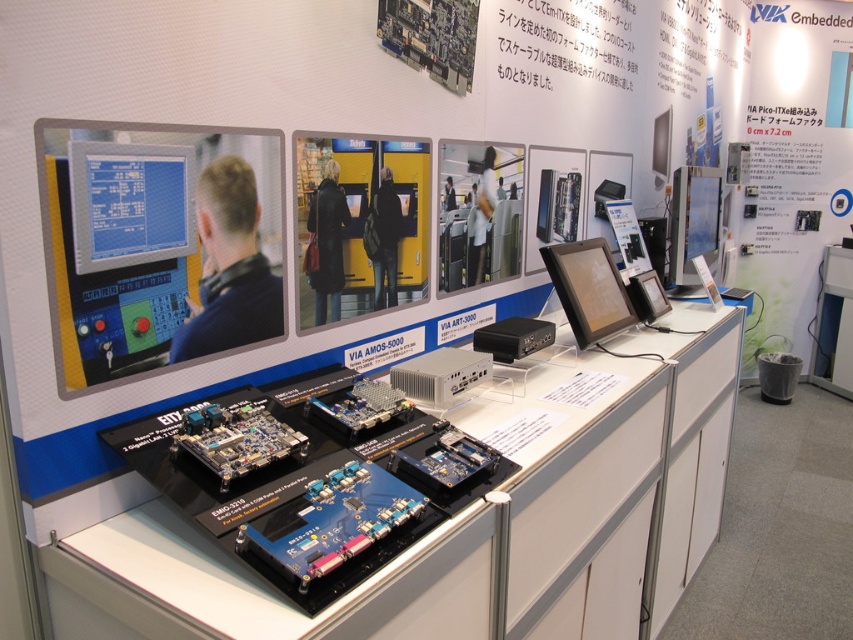
Is white paper at upper right to the left of matte black monitor at center from the viewer's perspective?

In fact, white paper at upper right is to the right of matte black monitor at center.

What do you see at coordinates (793, 163) in the screenshot? Image resolution: width=853 pixels, height=640 pixels. I see `white paper at upper right` at bounding box center [793, 163].

The height and width of the screenshot is (640, 853). Identify the location of white paper at upper right. (793, 163).

Image resolution: width=853 pixels, height=640 pixels. What are the coordinates of `white paper at upper right` in the screenshot? It's located at (793, 163).

You are a GUI agent. You are given a task and a screenshot of the screen. Output one action in this format:
    pyautogui.click(x=<x>, y=<y>)
    Task: Click on the blue glossy monitor at upper left
    
    Given the screenshot: What is the action you would take?
    pyautogui.click(x=131, y=204)

Does blue glossy monitor at upper left have a lesser width compared to blue circuit board at center?

Correct, blue glossy monitor at upper left's width is less than blue circuit board at center's.

Which is behind, point (186, 216) or point (221, 445)?

Point (186, 216)

Locate an element on the screen. The width and height of the screenshot is (853, 640). blue glossy monitor at upper left is located at coordinates point(131,204).

Is white paper at upper right shorter than matte black monitor at upper right?

In fact, white paper at upper right may be taller than matte black monitor at upper right.

Identify the location of white paper at upper right. Image resolution: width=853 pixels, height=640 pixels. (793, 163).